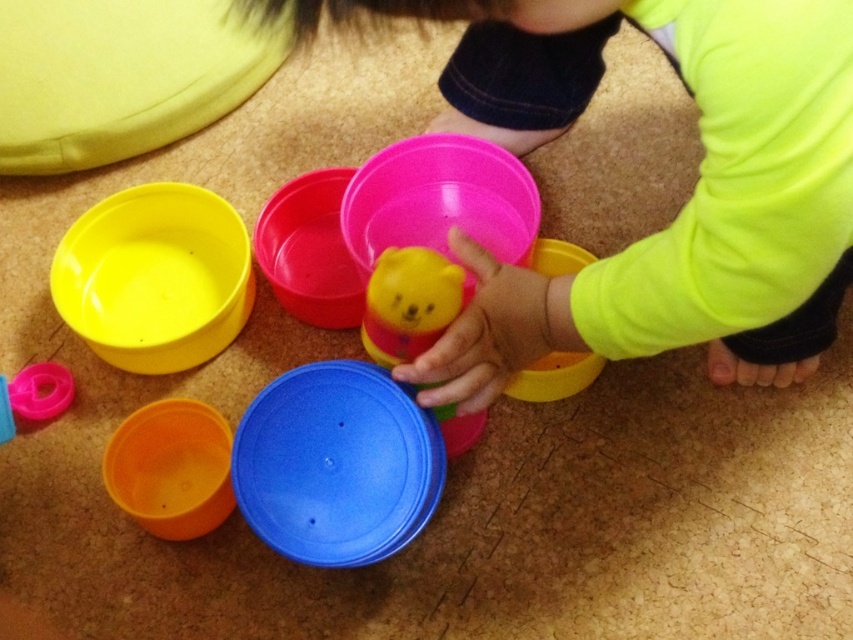
Is pink plastic bowl at center taller than matte yellow bowl at center?

No.

Is pink plastic bowl at center above matte yellow bowl at center?

Indeed, pink plastic bowl at center is positioned over matte yellow bowl at center.

Does point (457, 156) come farther from viewer compared to point (521, 387)?

That is True.

This screenshot has width=853, height=640. What are the coordinates of `pink plastic bowl at center` in the screenshot? It's located at (440, 198).

Is rubber bear toy at center wider than yellow matte bear at center?

Indeed, rubber bear toy at center has a greater width compared to yellow matte bear at center.

Between rubber bear toy at center and yellow matte bear at center, which one appears on the right side from the viewer's perspective?

From the viewer's perspective, rubber bear toy at center appears more on the right side.

Is point (451, 401) positioned before point (451, 310)?

No, it is not.

I want to click on rubber bear toy at center, so click(683, 205).

Does blue plastic lid at center have a lesser width compared to matte plastic bowl at left?

Correct, blue plastic lid at center's width is less than matte plastic bowl at left's.

Does point (318, 500) lie in front of point (244, 244)?

Yes, point (318, 500) is in front of point (244, 244).

Between point (357, 404) and point (209, 243), which one is positioned in front?

Point (357, 404) is more forward.

Find the location of a particular element. blue plastic lid at center is located at coordinates (335, 465).